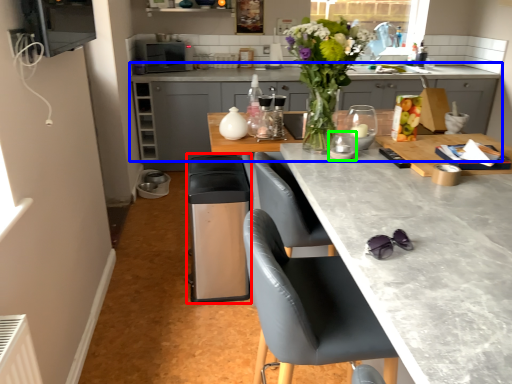
Question: Considering the real-world distances, which object is farthest from appliance (highlighted by a red box)? cabinetry (highlighted by a blue box) or appliance (highlighted by a green box)?

Choices:
 (A) cabinetry
 (B) appliance

Answer: (A)